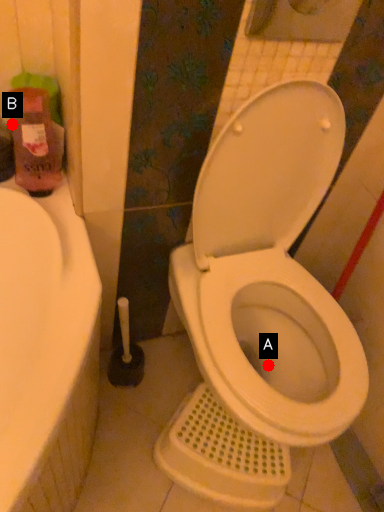
Question: Two points are circled on the image, labeled by A and B beside each circle. Which of the following is the farthest from the observer?

Choices:
 (A) A is further
 (B) B is further

Answer: (A)